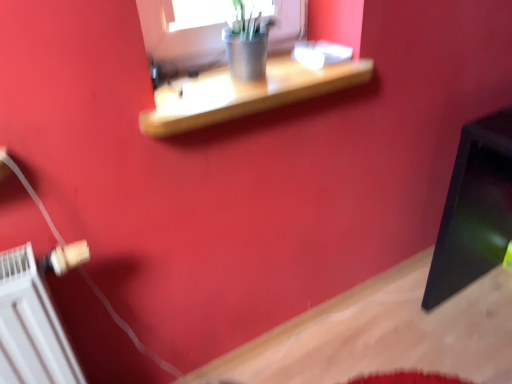
At what (x,y) coordinates should I click in order to perform the action: click on white plastic radiator at lower left. Please return your answer as a coordinate pair (x, y). Image resolution: width=512 pixels, height=384 pixels. Looking at the image, I should click on (35, 318).

What do you see at coordinates (35, 318) in the screenshot? I see `white plastic radiator at lower left` at bounding box center [35, 318].

Locate an element on the screen. The image size is (512, 384). wooden shelf at upper center is located at coordinates (245, 94).

This screenshot has width=512, height=384. Describe the element at coordinates (245, 94) in the screenshot. I see `wooden shelf at upper center` at that location.

Where is `white plastic radiator at lower left`? This screenshot has width=512, height=384. white plastic radiator at lower left is located at coordinates (35, 318).

Which object is positioned more to the right, white plastic radiator at lower left or wooden shelf at upper center?

From the viewer's perspective, wooden shelf at upper center appears more on the right side.

Which object is closer to the camera, white plastic radiator at lower left or wooden shelf at upper center?

white plastic radiator at lower left.

Considering the positions of points (8, 314) and (324, 70), is point (8, 314) farther from camera compared to point (324, 70)?

No, (8, 314) is closer to viewer.

From the image's perspective, is white plastic radiator at lower left on wooden shelf at upper center?

Actually, white plastic radiator at lower left appears below wooden shelf at upper center in the image.

Looking at this image, from a real-world perspective, between white plastic radiator at lower left and wooden shelf at upper center, who is vertically higher?

In real-world perspective, wooden shelf at upper center is above.

Looking at this image, which of these two, white plastic radiator at lower left or wooden shelf at upper center, is thinner?

Thinner between the two is white plastic radiator at lower left.

Does white plastic radiator at lower left have a greater height compared to wooden shelf at upper center?

Correct, white plastic radiator at lower left is much taller as wooden shelf at upper center.

Is white plastic radiator at lower left smaller than wooden shelf at upper center?

Incorrect, white plastic radiator at lower left is not smaller in size than wooden shelf at upper center.

Is white plastic radiator at lower left inside the boundaries of wooden shelf at upper center, or outside?

white plastic radiator at lower left is outside wooden shelf at upper center.

Is white plastic radiator at lower left not near wooden shelf at upper center?

No.

Is white plastic radiator at lower left oriented away from wooden shelf at upper center?

white plastic radiator at lower left is not turned away from wooden shelf at upper center.

I want to click on radiator on the left side of wooden shelf at upper center, so click(35, 318).

Between wooden shelf at upper center and white plastic radiator at lower left, which one appears on the left side from the viewer's perspective?

From the viewer's perspective, white plastic radiator at lower left appears more on the left side.

Consider the image. Considering the positions of objects wooden shelf at upper center and white plastic radiator at lower left in the image provided, who is in front, wooden shelf at upper center or white plastic radiator at lower left?

Positioned in front is white plastic radiator at lower left.

Considering the points (172, 116) and (59, 374), which point is behind, point (172, 116) or point (59, 374)?

The point (59, 374) is more distant.

From the image's perspective, which one is positioned lower, wooden shelf at upper center or white plastic radiator at lower left?

white plastic radiator at lower left.

Looking at this image, from a real-world perspective, does wooden shelf at upper center sit lower than white plastic radiator at lower left?

No, from a real-world perspective, wooden shelf at upper center is not below white plastic radiator at lower left.

Considering the sizes of objects wooden shelf at upper center and white plastic radiator at lower left in the image provided, who is wider, wooden shelf at upper center or white plastic radiator at lower left?

wooden shelf at upper center.

Considering the relative sizes of wooden shelf at upper center and white plastic radiator at lower left in the image provided, is wooden shelf at upper center shorter than white plastic radiator at lower left?

Correct, wooden shelf at upper center is not as tall as white plastic radiator at lower left.

Is wooden shelf at upper center bigger than white plastic radiator at lower left?

Incorrect, wooden shelf at upper center is not larger than white plastic radiator at lower left.

Is wooden shelf at upper center outside of white plastic radiator at lower left?

Yes, wooden shelf at upper center is outside of white plastic radiator at lower left.

Are wooden shelf at upper center and white plastic radiator at lower left far apart?

They are positioned close to each other.

Is white plastic radiator at lower left at the back of wooden shelf at upper center?

wooden shelf at upper center does not have its back to white plastic radiator at lower left.

Measure the distance between wooden shelf at upper center and white plastic radiator at lower left.

They are 18.83 inches apart.

Identify the location of radiator that appears below the wooden shelf at upper center (from the image's perspective). Image resolution: width=512 pixels, height=384 pixels. (35, 318).

The image size is (512, 384). What are the coordinates of `radiator lying on the left of wooden shelf at upper center` in the screenshot? It's located at (35, 318).

Find the location of a particular element. This screenshot has height=384, width=512. radiator below the wooden shelf at upper center (from the image's perspective) is located at coordinates (35, 318).